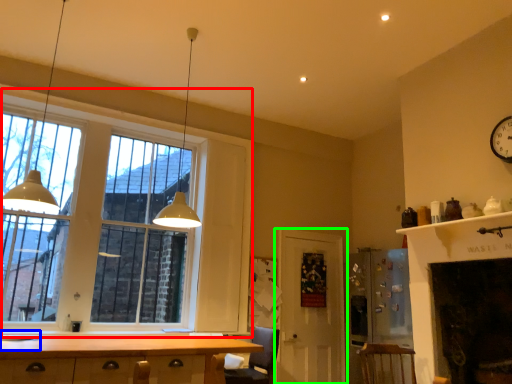
Question: Which object is positioned farthest from window (highlighted by a red box)? Select from sink (highlighted by a blue box) and door (highlighted by a green box).

Choices:
 (A) sink
 (B) door

Answer: (A)